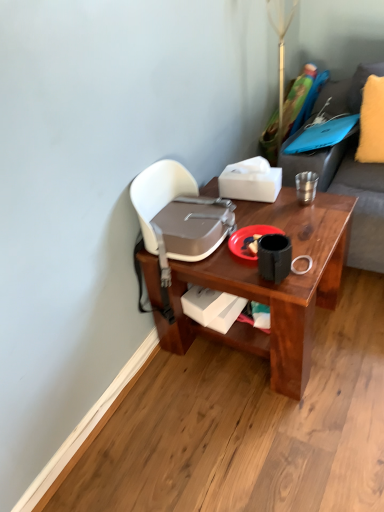
Where is `vacant space situated above brown wood desk at center (from a real-world perspective)`? vacant space situated above brown wood desk at center (from a real-world perspective) is located at coordinates [x=271, y=222].